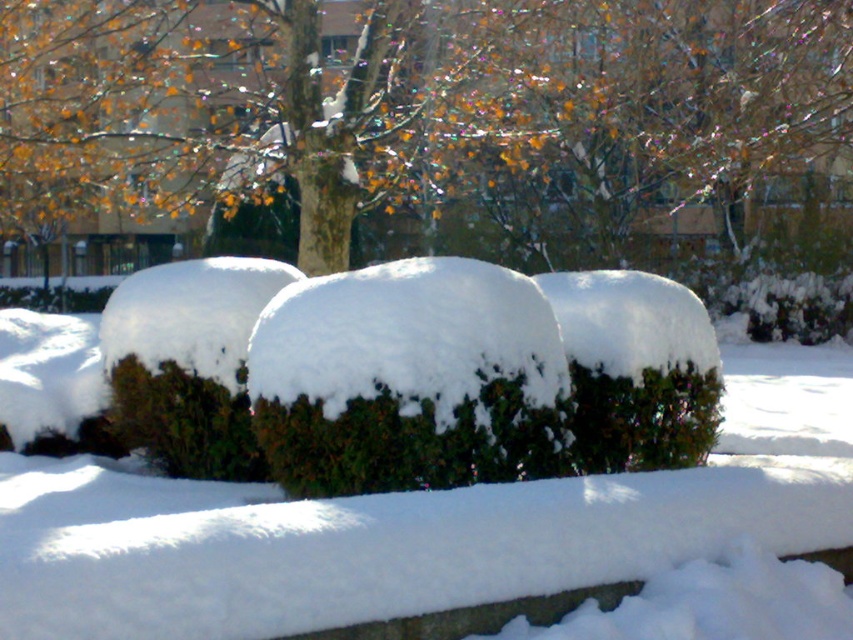
Which is behind, point (740, 102) or point (251, 432)?

Point (740, 102)

Does green leafy tree at center appear on the right side of green matte bush at center?

Yes, green leafy tree at center is to the right of green matte bush at center.

Between point (567, 144) and point (155, 412), which one is positioned behind?

The point (567, 144) is more distant.

This screenshot has width=853, height=640. I want to click on green leafy tree at center, so click(x=405, y=100).